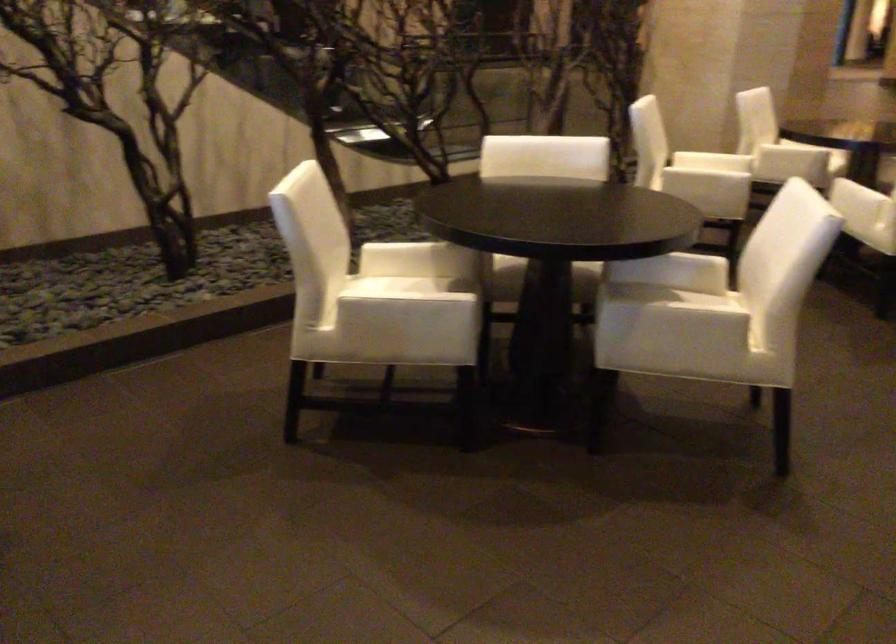
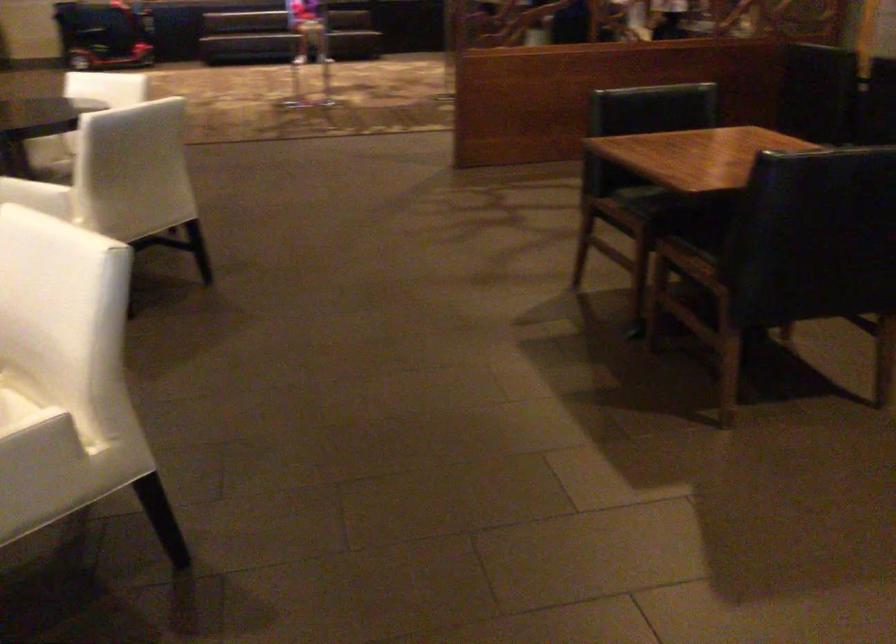
Question: The images are taken continuously from a first-person perspective. In which direction is your viewpoint rotating?

Choices:
 (A) Left
 (B) Right
 (C) Up
 (D) Down

Answer: (B)